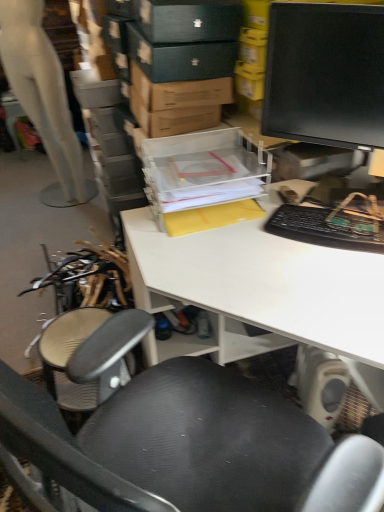
Where is `free point in front of black plastic keyboard at right`? The width and height of the screenshot is (384, 512). free point in front of black plastic keyboard at right is located at coordinates (336, 290).